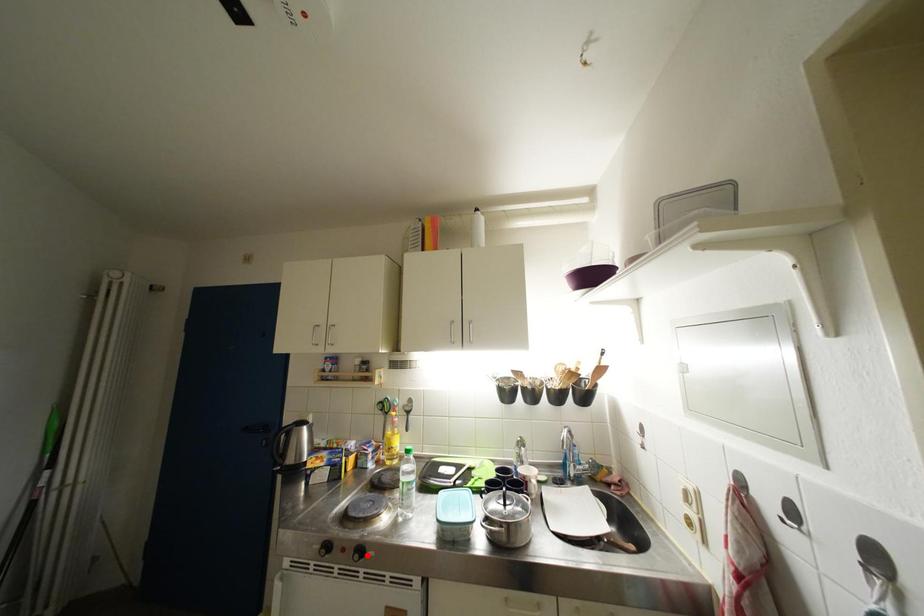
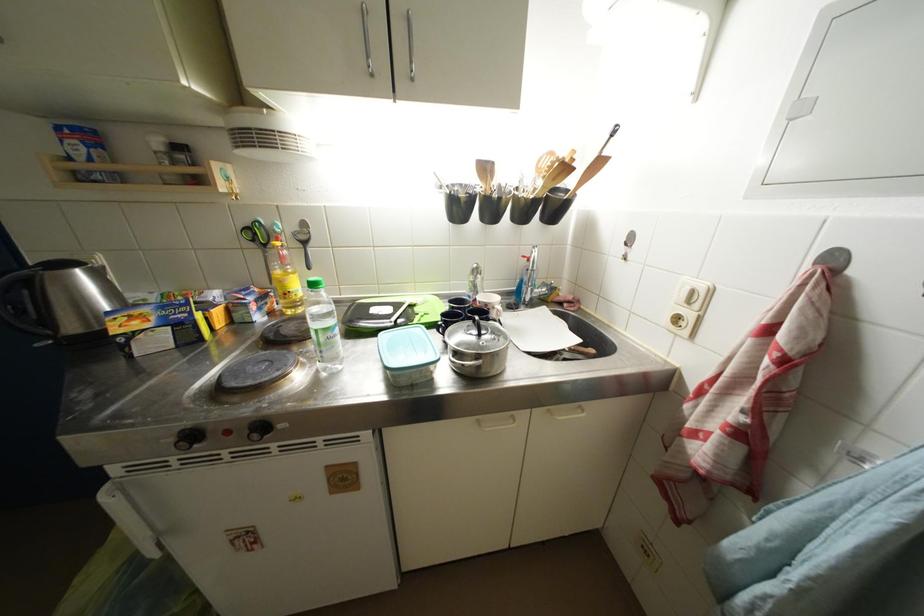
Locate, in the second image, the point that corresponds to the highlighted location in the first image.

(269, 431)